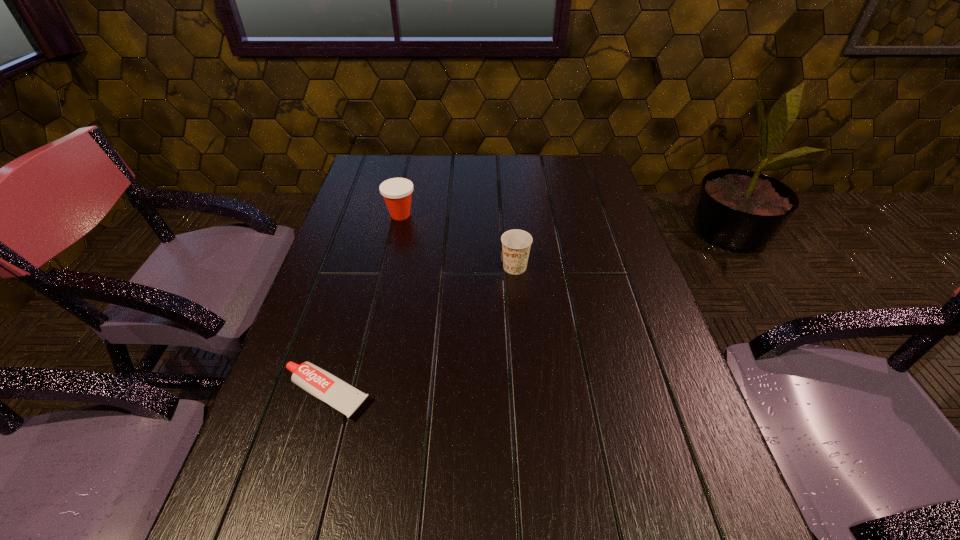
The height and width of the screenshot is (540, 960). Find the location of `free area in between the left Dixie cup and the nearer Dixie cup`. free area in between the left Dixie cup and the nearer Dixie cup is located at coordinates (458, 241).

Find the location of `free space between the left Dixie cup and the nearer Dixie cup`. free space between the left Dixie cup and the nearer Dixie cup is located at coordinates (458, 241).

The height and width of the screenshot is (540, 960). Find the location of `vacant point located between the nearer Dixie cup and the left Dixie cup`. vacant point located between the nearer Dixie cup and the left Dixie cup is located at coordinates (458, 241).

In order to click on free space between the nearest object and the farthest object in this screenshot , I will do `click(363, 305)`.

Where is `free space between the toothpaste and the rightmost object`? The height and width of the screenshot is (540, 960). free space between the toothpaste and the rightmost object is located at coordinates (420, 330).

Locate an element on the screen. The height and width of the screenshot is (540, 960). blank region between the farther Dixie cup and the second farthest object is located at coordinates (458, 241).

Locate an element on the screen. Image resolution: width=960 pixels, height=540 pixels. object that ranks as the closest to the farthest object is located at coordinates (516, 244).

Locate an element on the screen. object that is the closest to the farther Dixie cup is located at coordinates (516, 244).

Locate an element on the screen. The width and height of the screenshot is (960, 540). vacant region that satisfies the following two spatial constraints: 1. on the back side of the rightmost object; 2. on the right side of the shortest object is located at coordinates (363, 267).

This screenshot has width=960, height=540. Find the location of `blank area in the image that satisfies the following two spatial constraints: 1. on the back side of the rightmost object; 2. on the right side of the toothpaste`. blank area in the image that satisfies the following two spatial constraints: 1. on the back side of the rightmost object; 2. on the right side of the toothpaste is located at coordinates click(x=363, y=267).